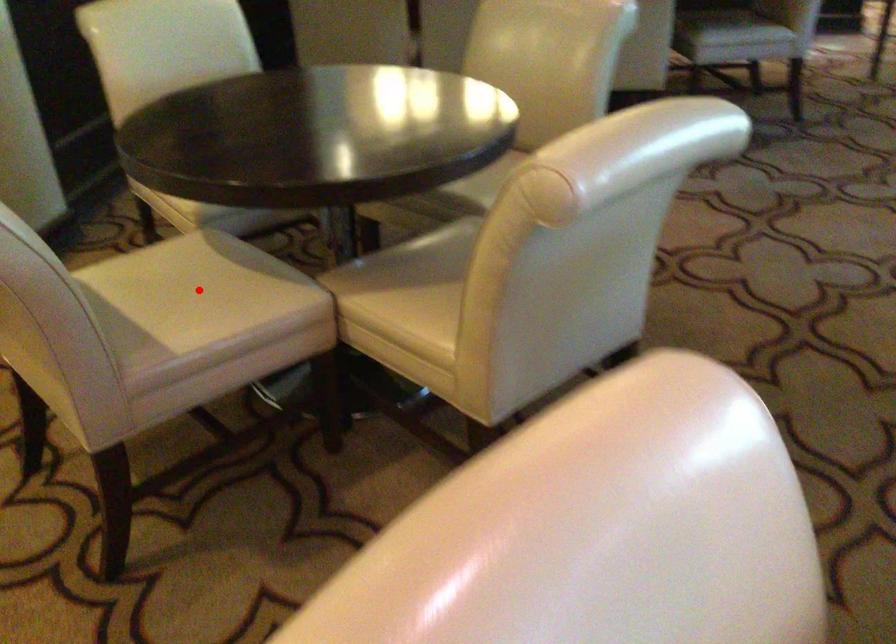
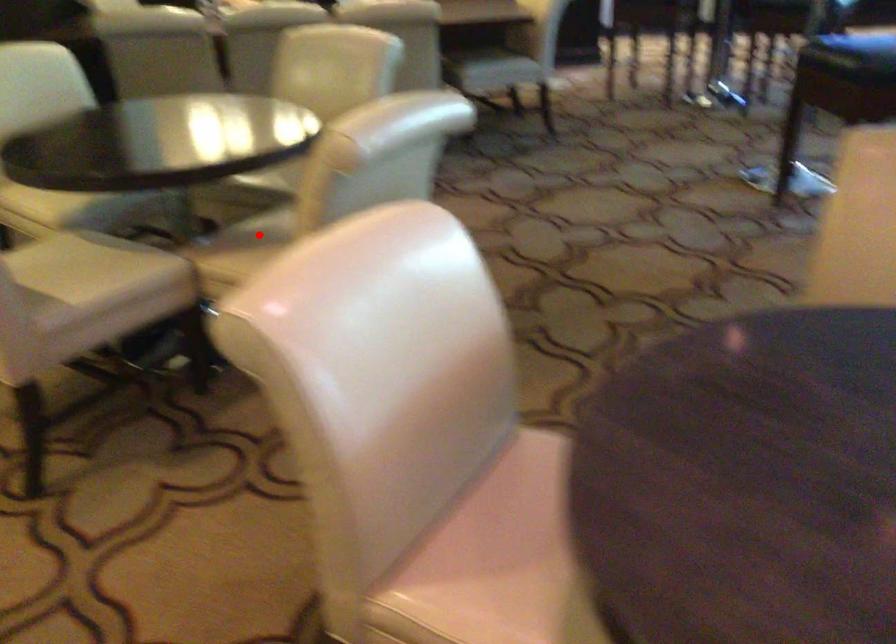
I am providing you with two images of the same scene from different viewpoints. A red point is marked on the first image and another point is marked on the second image. Are the points marked in image1 and image2 representing the same 3D position?

No